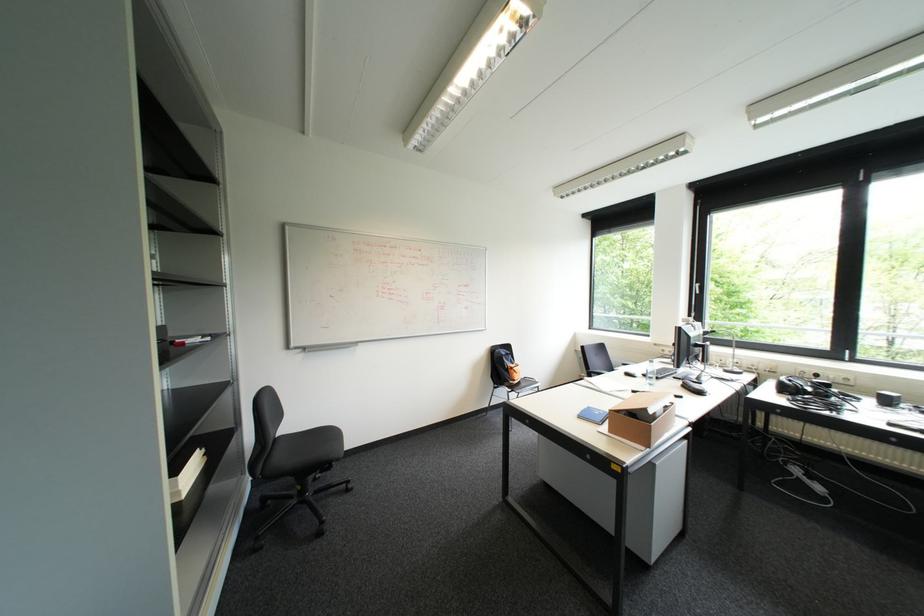
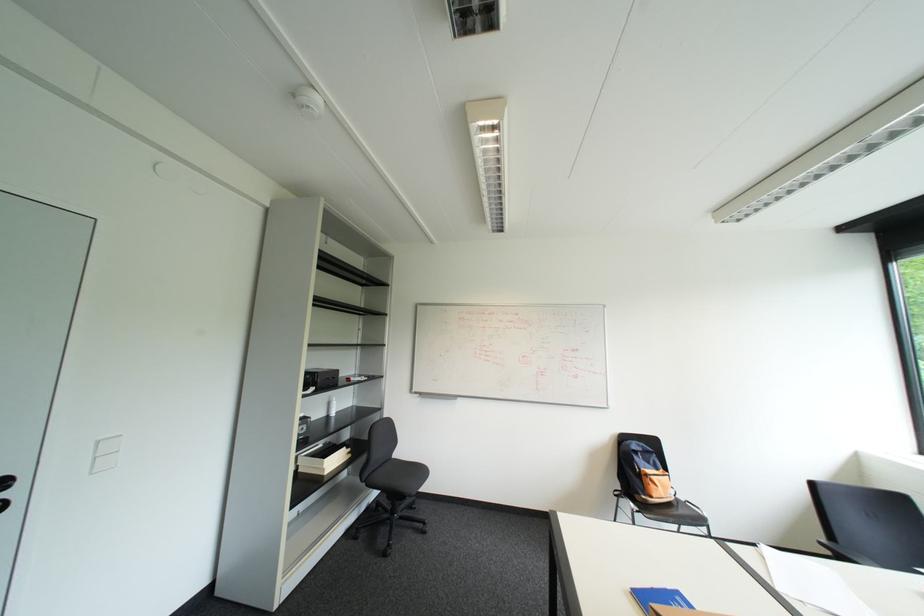
Question: The camera is either moving clockwise (left) or counter-clockwise (right) around the object. The first image is from the beginning of the video and the second image is from the end. Is the camera moving left or right when shooting the video?

Choices:
 (A) Left
 (B) Right

Answer: (B)